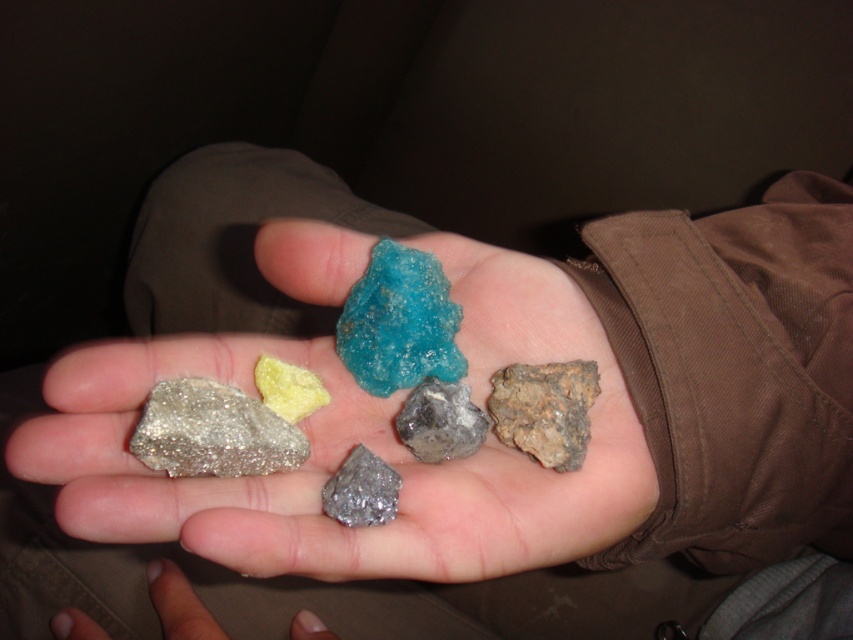
Is translucent blue crystal at center to the left of yellow crystalline mineral at center from the viewer's perspective?

No, translucent blue crystal at center is not to the left of yellow crystalline mineral at center.

At what (x,y) coordinates should I click in order to perform the action: click on translucent blue crystal at center. Please return your answer as a coordinate pair (x, y). This screenshot has width=853, height=640. Looking at the image, I should click on (399, 323).

Based on the photo, between translucent blue crystal at center and shiny metallic rock at center, which one appears on the right side from the viewer's perspective?

Positioned to the right is translucent blue crystal at center.

This screenshot has width=853, height=640. What are the coordinates of `translucent blue crystal at center` in the screenshot? It's located at (399, 323).

Does matte silver rock at center appear under slick gray rock at center?

Yes, matte silver rock at center is below slick gray rock at center.

Find the location of a particular element. This screenshot has height=640, width=853. matte silver rock at center is located at coordinates click(178, 604).

The width and height of the screenshot is (853, 640). Find the location of `matte silver rock at center`. matte silver rock at center is located at coordinates (178, 604).